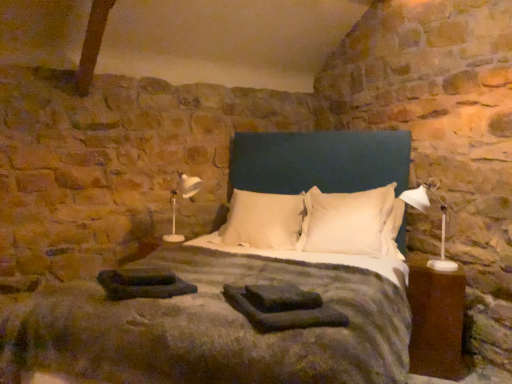
Question: From a real-world perspective, relative to white plastic table lamp at left, acting as the first table lamp starting from the left, is black fabric at lower left, placed as the 2th material when sorted from right to left, vertically above or below?

Choices:
 (A) below
 (B) above

Answer: (A)

Question: In terms of size, does black fabric at lower left, placed as the 2th material when sorted from right to left, appear bigger or smaller than white plastic table lamp at left, the 1th table lamp when ordered from back to front?

Choices:
 (A) small
 (B) big

Answer: (A)

Question: Which object is the closest to the white soft pillow at center, which is counted as the 1th pillow, starting from the right?

Choices:
 (A) white plastic table lamp at left, acting as the first table lamp starting from the left
 (B) white soft pillow at center, which appears as the 1th pillow when viewed from the left
 (C) brown wood nightstand at right
 (D) white plastic table lamp at right, which is the 2th table lamp in back-to-front order
 (E) dark gray fabric at center, arranged as the 1th material when viewed from the right

Answer: (B)

Question: Estimate the real-world distances between objects in this image. Which object is farther from the brown wood nightstand at right?

Choices:
 (A) dark gray fabric at center, arranged as the 1th material when viewed from the right
 (B) velvet blue bed at center
 (C) white plastic table lamp at right, the second table lamp when ordered from left to right
 (D) white soft pillow at center, the second pillow in the left-to-right sequence
 (E) white plastic table lamp at left, the 2th table lamp from the front

Answer: (E)